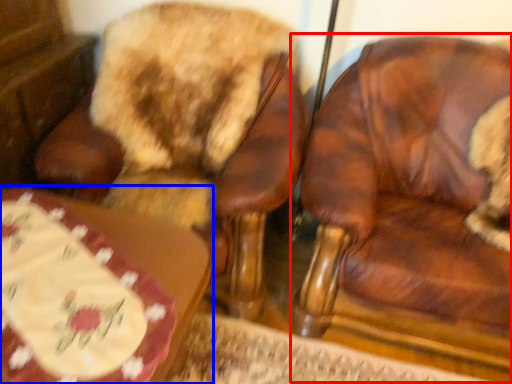
Question: Which object is closer to the camera taking this photo, chair (highlighted by a red box) or table (highlighted by a blue box)?

Choices:
 (A) chair
 (B) table

Answer: (B)